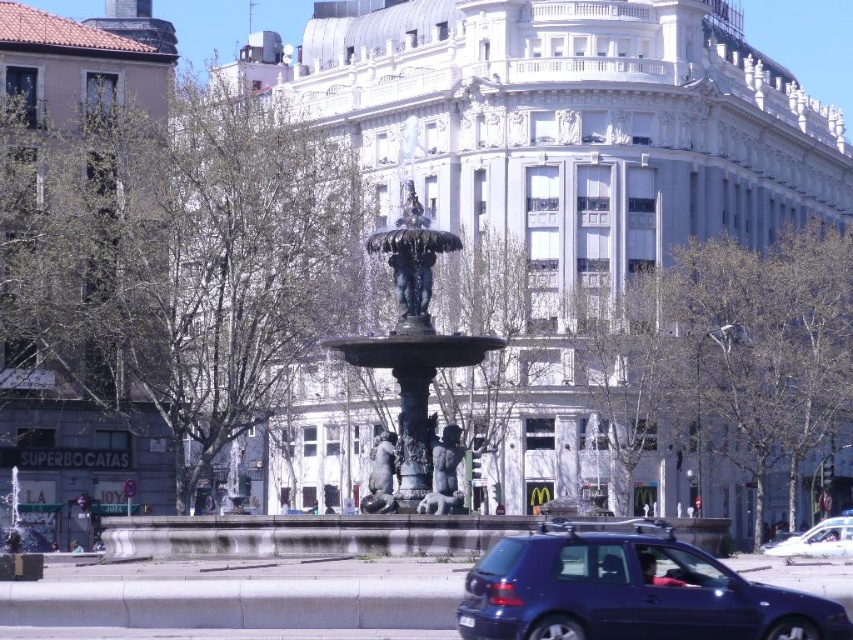
Question: Does green leafy tree at upper left appear over white glossy car at lower right?

Choices:
 (A) yes
 (B) no

Answer: (A)

Question: Considering the real-world distances, which object is closest to the green leafy tree at center?

Choices:
 (A) metallic blue hatchback at lower center
 (B) white glossy car at lower right

Answer: (B)

Question: Considering the real-world distances, which object is closest to the white glossy car at lower right?

Choices:
 (A) green leafy tree at center
 (B) metallic blue hatchback at lower center
 (C) green leafy tree at upper left

Answer: (A)

Question: Does green leafy tree at center appear on the left side of white glossy car at lower right?

Choices:
 (A) no
 (B) yes

Answer: (B)

Question: Which of the following is the closest to the observer?

Choices:
 (A) (285, 108)
 (B) (492, 456)

Answer: (B)

Question: Is green leafy tree at upper left to the right of white glossy car at lower right from the viewer's perspective?

Choices:
 (A) yes
 (B) no

Answer: (B)